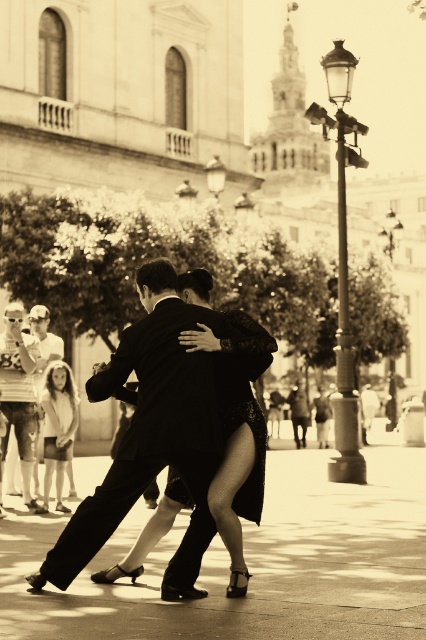
Question: Observing the image, what is the correct spatial positioning of black satin suit at center in reference to matte black suit at left?

Choices:
 (A) right
 (B) left

Answer: (A)

Question: Is black satin suit at center smaller than light beige fabric dress at lower left?

Choices:
 (A) yes
 (B) no

Answer: (B)

Question: Is black lace dress at center positioned behind light beige fabric dress at lower left?

Choices:
 (A) yes
 (B) no

Answer: (B)

Question: Among these points, which one is farthest from the camera?

Choices:
 (A) (9, 364)
 (B) (186, 442)
 (C) (235, 355)

Answer: (A)

Question: Which of the following is the farthest from the observer?

Choices:
 (A) (60, 385)
 (B) (175, 417)
 (C) (233, 444)
 (D) (5, 378)

Answer: (A)

Question: Which of the following is the farthest from the observer?

Choices:
 (A) (20, 438)
 (B) (57, 472)
 (C) (34, 577)

Answer: (B)